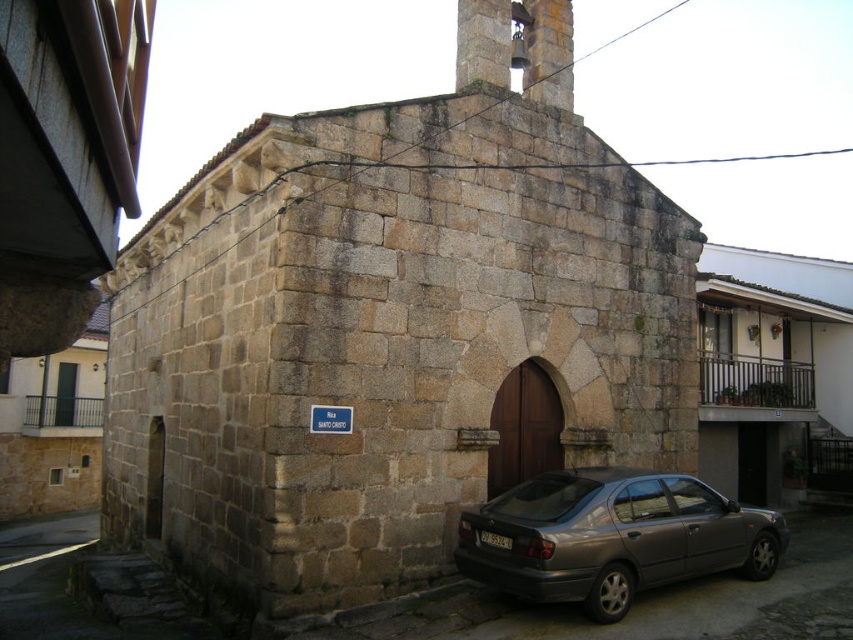
Is point (585, 432) less distant than point (546, 566)?

No, it is not.

Can you confirm if stone chapel at center is positioned above metallic gray sedan at lower right?

Correct, stone chapel at center is located above metallic gray sedan at lower right.

Is point (410, 380) farther from camera compared to point (741, 518)?

No, it is in front of (741, 518).

Locate an element on the screen. The height and width of the screenshot is (640, 853). stone chapel at center is located at coordinates (392, 328).